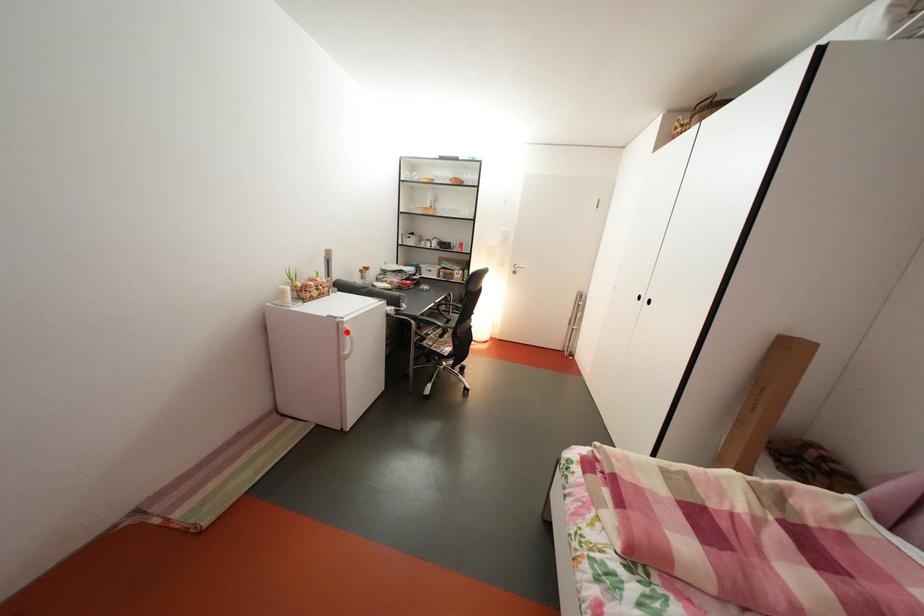
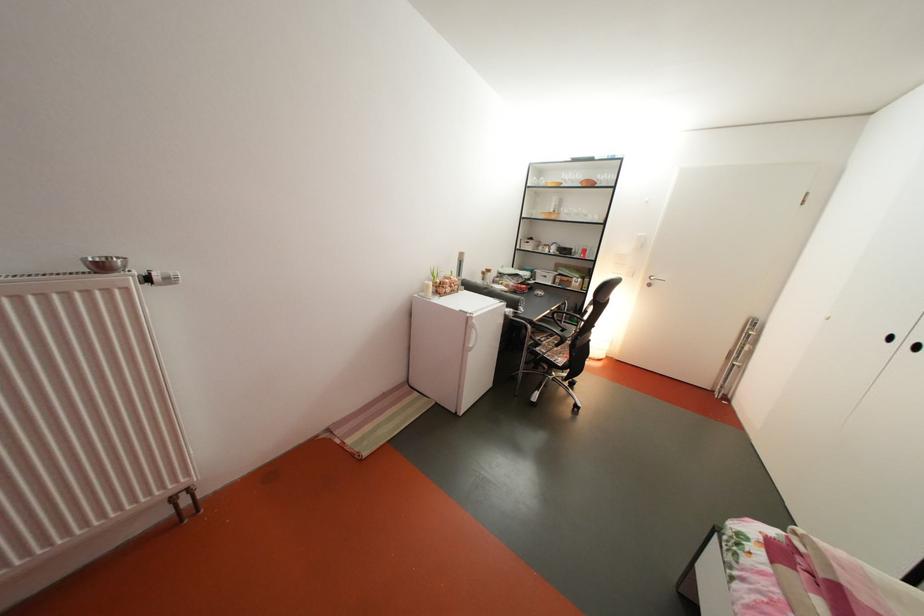
Question: I am providing you with two images of the same scene from different viewpoints. A red point is marked on the first image. Is the red point's position out of view in image 2?

Choices:
 (A) Yes
 (B) No

Answer: (B)